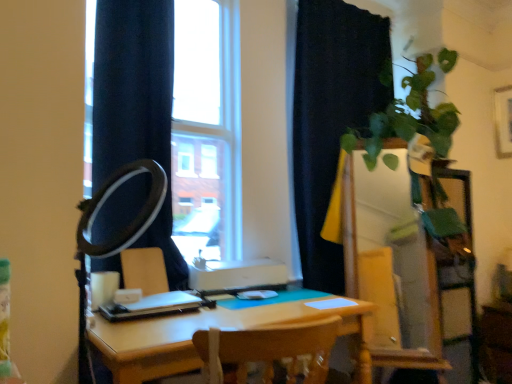
The image size is (512, 384). What do you see at coordinates (393, 263) in the screenshot?
I see `green glossy dresser at right` at bounding box center [393, 263].

I want to click on black matte curtain at upper right, so click(331, 117).

In order to face matte white armchair at center, should I rotate leftwards or rightwards?

Rotate left and turn 14.688 degrees.

This screenshot has width=512, height=384. Describe the element at coordinates (144, 270) in the screenshot. I see `matte white armchair at center` at that location.

Measure the distance between black matte ring light at left and camera.

3.33 feet.

Identify the location of green glossy dresser at right. (393, 263).

Are matte white armchair at center and black matte ring light at left making contact?

No, matte white armchair at center is not in contact with black matte ring light at left.

From a real-world perspective, relative to black matte ring light at left, is matte white armchair at center vertically above or below?

Clearly, from a real-world perspective, matte white armchair at center is below black matte ring light at left.

In the scene shown: Which point is more forward, (156, 259) or (100, 203)?

The point (100, 203) is closer to the camera.

Is matte white armchair at center oriented away from black matte ring light at left?

That's not correct — matte white armchair at center is not looking away from black matte ring light at left.

Does light brown wooden table at center touch matte white armchair at center?

There is a gap between light brown wooden table at center and matte white armchair at center.

Can you tell me how much light brown wooden table at center and matte white armchair at center differ in facing direction?

The angular difference between light brown wooden table at center and matte white armchair at center is 5.18 degrees.

From the image's perspective, is light brown wooden table at center above matte white armchair at center?

No.

Visually, is light brown wooden table at center positioned to the left or to the right of matte white armchair at center?

light brown wooden table at center is positioned on matte white armchair at center's right side.

Consider the image. From the image's perspective, between light brown wooden table at center and green glossy dresser at right, which one is located above?

green glossy dresser at right, from the image's perspective.

In the image, is light brown wooden table at center on the left side or the right side of green glossy dresser at right?

light brown wooden table at center is positioned on green glossy dresser at right's left side.

Is green glossy dresser at right surrounded by light brown wooden table at center?

No, light brown wooden table at center does not contain green glossy dresser at right.

How distant is light brown wooden table at center from green glossy dresser at right?

light brown wooden table at center and green glossy dresser at right are 33.98 inches apart from each other.

Based on the photo, how different are the orientations of green glossy dresser at right and black matte curtain at upper right in degrees?

The facing directions of green glossy dresser at right and black matte curtain at upper right are 51.8 degrees apart.

Considering the relative sizes of green glossy dresser at right and black matte curtain at upper right in the image provided, is green glossy dresser at right thinner than black matte curtain at upper right?

No, green glossy dresser at right is not thinner than black matte curtain at upper right.

In the scene shown: Considering the relative sizes of green glossy dresser at right and black matte curtain at upper right in the image provided, is green glossy dresser at right shorter than black matte curtain at upper right?

Indeed, green glossy dresser at right has a lesser height compared to black matte curtain at upper right.

In the scene shown: Considering the positions of objects green glossy dresser at right and black matte curtain at upper right in the image provided, who is in front, green glossy dresser at right or black matte curtain at upper right?

green glossy dresser at right is more forward.

Measure the distance from black matte ring light at left to green glossy dresser at right.

The distance of black matte ring light at left from green glossy dresser at right is 5.46 feet.

Is black matte ring light at left next to green glossy dresser at right and touching it?

No, black matte ring light at left is not with green glossy dresser at right.

This screenshot has width=512, height=384. Find the location of `table lamp on the left of green glossy dresser at right`. table lamp on the left of green glossy dresser at right is located at coordinates (114, 236).

Considering the sizes of black matte ring light at left and green glossy dresser at right in the image, is black matte ring light at left taller or shorter than green glossy dresser at right?

Considering their sizes, black matte ring light at left has less height than green glossy dresser at right.

Considering the positions of objects matte white armchair at center and green glossy dresser at right in the image provided, who is more to the left, matte white armchair at center or green glossy dresser at right?

Positioned to the left is matte white armchair at center.

Does matte white armchair at center have a smaller size compared to green glossy dresser at right?

Correct, matte white armchair at center occupies less space than green glossy dresser at right.

Which object is thinner, matte white armchair at center or green glossy dresser at right?

matte white armchair at center.

From a real-world perspective, is matte white armchair at center beneath green glossy dresser at right?

Incorrect, from a real-world perspective, matte white armchair at center is higher than green glossy dresser at right.

Considering the points (84, 304) and (329, 278), which point is behind, point (84, 304) or point (329, 278)?

Positioned behind is point (329, 278).

Which of these two, black matte ring light at left or black matte curtain at upper right, stands taller?

black matte curtain at upper right is taller.

How different are the orientations of black matte ring light at left and black matte curtain at upper right in degrees?

There is a 89.3-degree angle between the facing directions of black matte ring light at left and black matte curtain at upper right.

Is black matte ring light at left facing towards black matte curtain at upper right?

Yes.

At what (x,y) coordinates should I click in order to perform the action: click on table lamp in front of the matte white armchair at center. Please return your answer as a coordinate pair (x, y). Image resolution: width=512 pixels, height=384 pixels. Looking at the image, I should click on (114, 236).

I want to click on armchair lying behind the light brown wooden table at center, so pyautogui.click(x=144, y=270).

When comparing their distances from green glossy dresser at right, does black matte curtain at upper right or matte white armchair at center seem closer?

The object closer to green glossy dresser at right is black matte curtain at upper right.

Looking at the image, which one is located closer to transparent glass window at center, matte white armchair at center or black matte curtain at upper right?

black matte curtain at upper right is closer to transparent glass window at center.

Considering their positions, is green glossy dresser at right positioned further to light brown wooden table at center than matte white armchair at center?

green glossy dresser at right is further to light brown wooden table at center.

Which object lies nearer to the anchor point light brown wooden table at center, matte white armchair at center or transparent glass window at center?

matte white armchair at center lies closer to light brown wooden table at center than the other object.

From the image, which object appears to be nearer to matte white armchair at center, transparent glass window at center or black matte ring light at left?

black matte ring light at left is positioned closer to the anchor matte white armchair at center.

Which object lies nearer to the anchor point light brown wooden table at center, black matte ring light at left or black matte curtain at upper right?

black matte ring light at left.

When comparing their distances from light brown wooden table at center, does black matte curtain at upper right or matte white armchair at center seem closer?

matte white armchair at center is closer to light brown wooden table at center.

From the image, which object appears to be nearer to black matte ring light at left, black matte curtain at upper right or matte white armchair at center?

matte white armchair at center is closer to black matte ring light at left.

At what (x,y) coordinates should I click in order to perform the action: click on armchair between black matte ring light at left and black matte curtain at upper right along the z-axis. Please return your answer as a coordinate pair (x, y). This screenshot has width=512, height=384. Looking at the image, I should click on (144, 270).

What are the coordinates of `armchair between transparent glass window at center and light brown wooden table at center from top to bottom` in the screenshot? It's located at (144, 270).

Identify the location of table lamp between transparent glass window at center and light brown wooden table at center in the up-down direction. (114, 236).

The width and height of the screenshot is (512, 384). I want to click on armchair located between transparent glass window at center and green glossy dresser at right in the left-right direction, so click(144, 270).